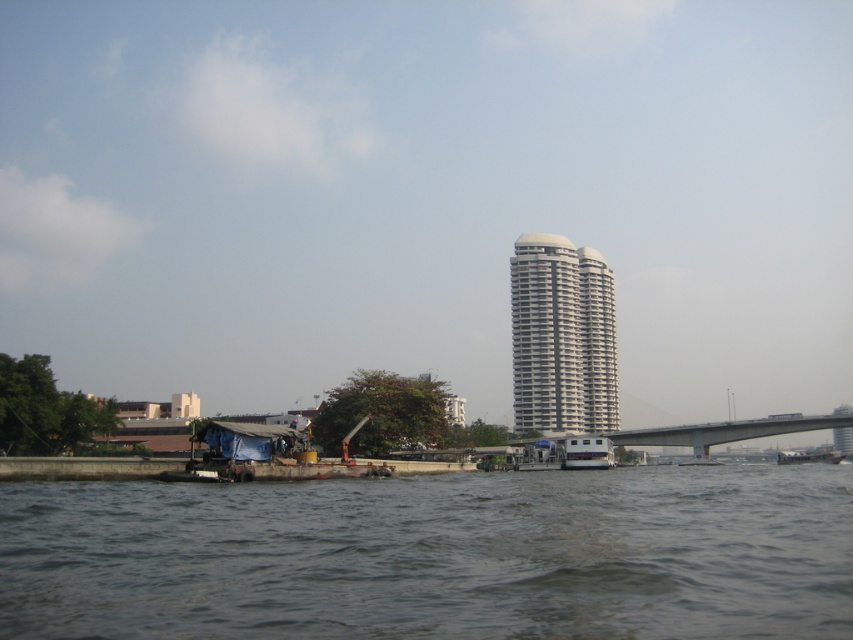
You are a photographer standing at the riverside and want to capture both the dark gray water at lower center and the white plastic boat at center in your shot. Which object will appear larger in your photo?

The dark gray water at lower center will appear larger in the photo because it is closer to the viewer than the white plastic boat at center.

You are a delivery person needing to cross the river using the white plastic boat at center. The concrete gray bridge at center right is closed for repairs. Can the boat safely carry your delivery truck which is 2 meters wide?

The concrete gray bridge at center right is wider than the white plastic boat at center. Since the truck is 2 meters wide and the boat is narrower than the bridge, the boat cannot safely carry the truck.

You are a boat operator who needs to navigate a white plastic boat at center through the dark gray water at lower center. Considering the size difference between them, will the boat fit comfortably in the water area?

The dark gray water at lower center is larger in size than the white plastic boat at center, so the boat will fit comfortably within the water area.